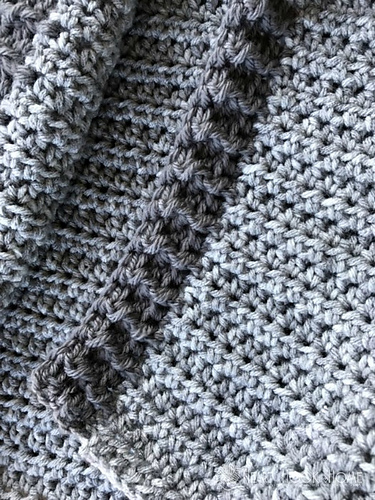
Identify the location of material for a rug or blanket. (192, 267).